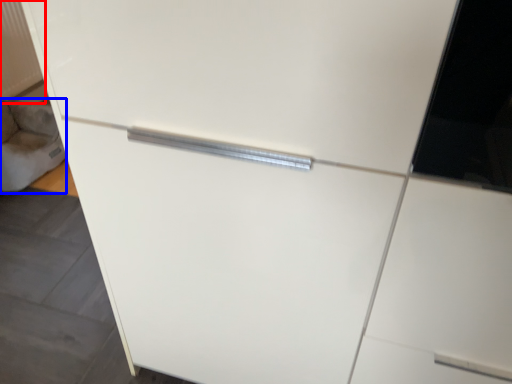
Question: Which point is further to the camera, radiator (highlighted by a red box) or gray (highlighted by a blue box)?

Choices:
 (A) radiator
 (B) gray

Answer: (A)